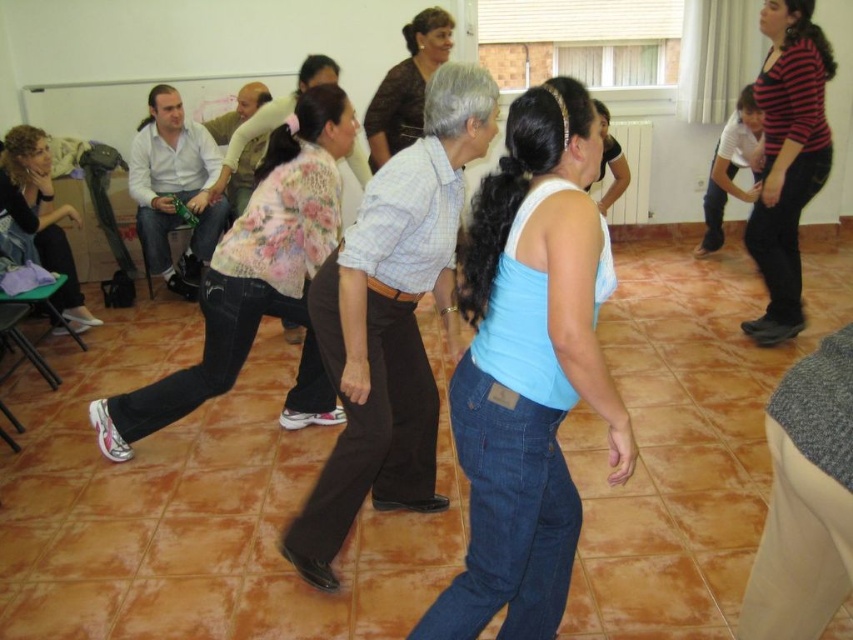
Question: Is brown cotton pants at center to the right of floral-patterned shirt at center from the viewer's perspective?

Choices:
 (A) no
 (B) yes

Answer: (B)

Question: Can you confirm if light blue denim jeans at center is positioned to the right of matte black hair at left?

Choices:
 (A) no
 (B) yes

Answer: (B)

Question: Which object appears closest to the camera in this image?

Choices:
 (A) matte white shirt at left
 (B) striped cotton shirt at upper right
 (C) floral-patterned shirt at center

Answer: (C)

Question: Among these points, which one is farthest from the camera?

Choices:
 (A) (30, 144)
 (B) (193, 172)

Answer: (B)

Question: Can you confirm if brown cotton pants at center is smaller than matte black hair at left?

Choices:
 (A) yes
 (B) no

Answer: (B)

Question: Which point is closer to the camera taking this photo?

Choices:
 (A) (395, 212)
 (B) (83, 305)
 (C) (350, 129)

Answer: (A)